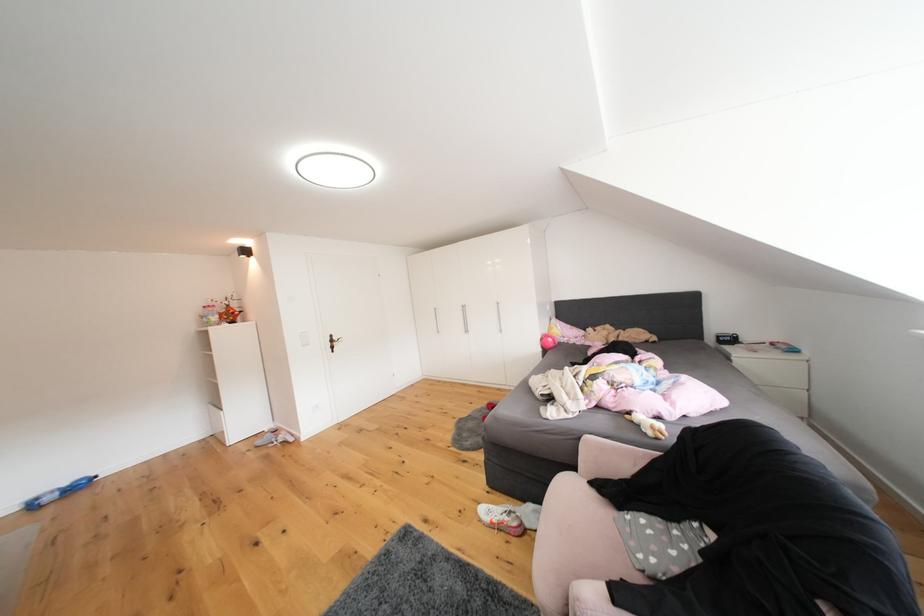
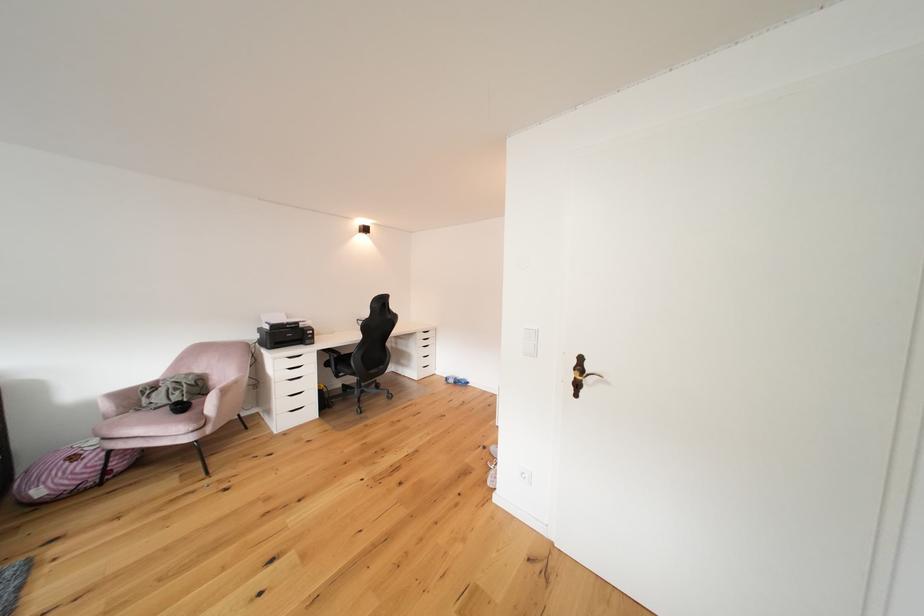
The point at (42, 509) is marked in the first image. Where is the corresponding point in the second image?

(456, 383)